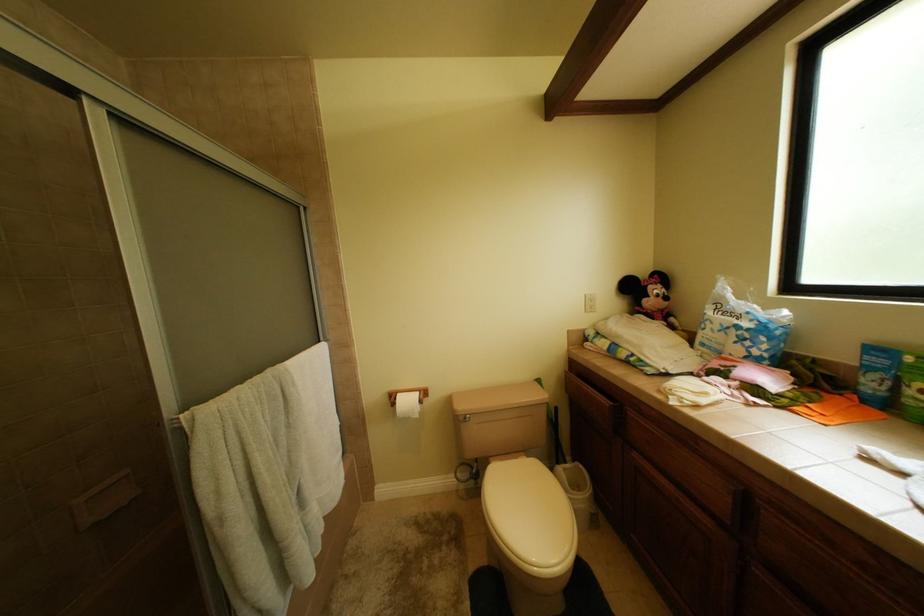
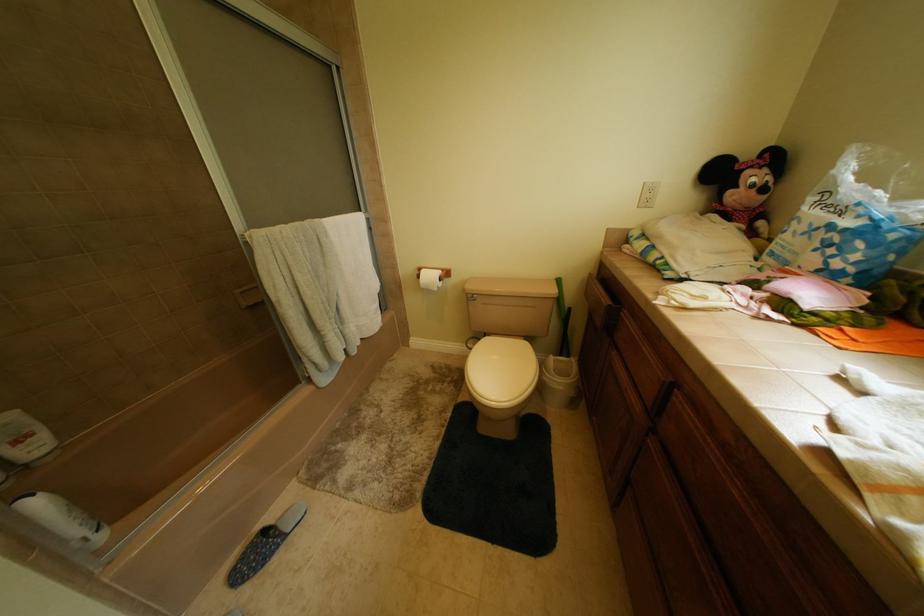
First-person continuous shooting, in which direction is the camera rotating?

The camera's rotation is toward left-down.